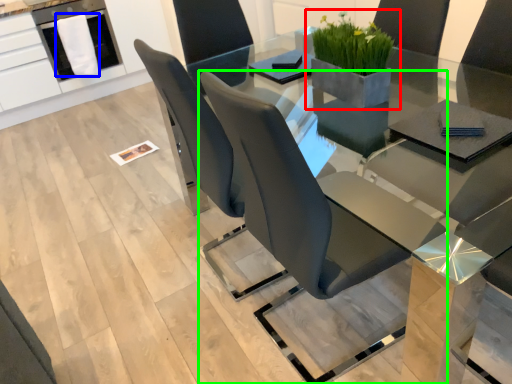
Question: Based on their relative distances, which object is nearer to houseplant (highlighted by a red box)? Choose from cloth (highlighted by a blue box) and chair (highlighted by a green box).

Choices:
 (A) cloth
 (B) chair

Answer: (B)